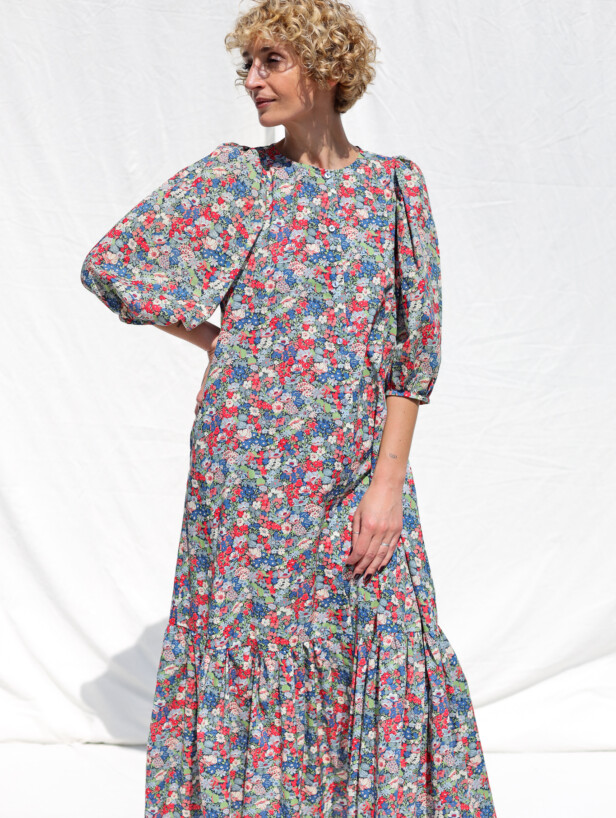
You are a GUI agent. You are given a task and a screenshot of the screen. Output one action in this format:
    pyautogui.click(x=<x>, y=<y>)
    Task: Click on the floor
    
    Given the screenshot: What is the action you would take?
    pyautogui.click(x=79, y=774)